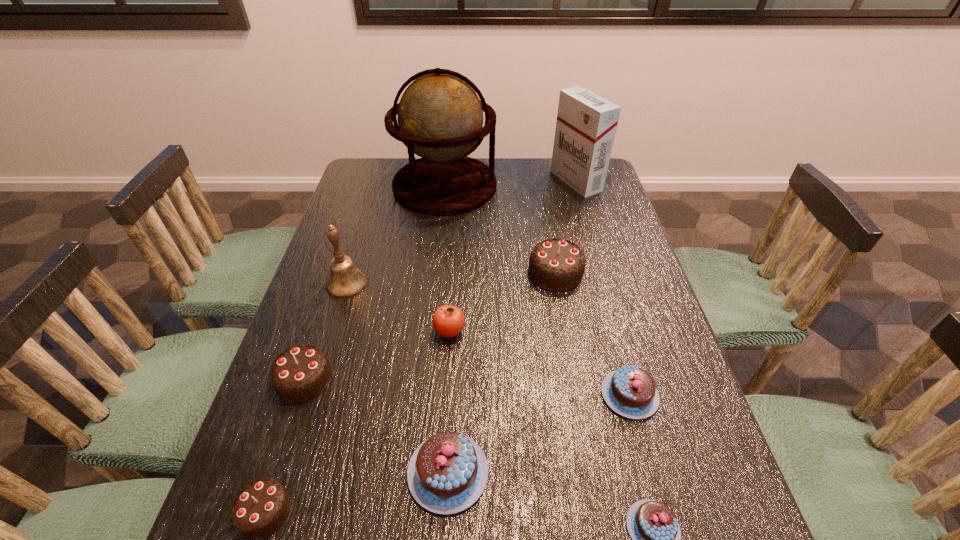
Locate an element on the screen. This screenshot has height=540, width=960. pink chocolate cake object that ranks as the second closest to the sixth nearest object is located at coordinates (630, 391).

You are a GUI agent. You are given a task and a screenshot of the screen. Output one action in this format:
    pyautogui.click(x=<x>, y=<y>)
    Task: Click on the free space in the image that satisfies the following two spatial constraints: 1. on the front side of the nearest chocolate chocolate cake; 2. on the right side of the second smallest chocolate chocolate cake
    The image size is (960, 540).
    Given the screenshot: What is the action you would take?
    pyautogui.click(x=260, y=511)

Where is `free point that satisfies the following two spatial constraints: 1. on the front-facing side of the tallest object; 2. on the right side of the biggest pink chocolate cake`? free point that satisfies the following two spatial constraints: 1. on the front-facing side of the tallest object; 2. on the right side of the biggest pink chocolate cake is located at coordinates (415, 472).

Where is `free location that satisfies the following two spatial constraints: 1. on the front-facing side of the fourth chocolate cake from right to left; 2. on the left side of the globe`? The height and width of the screenshot is (540, 960). free location that satisfies the following two spatial constraints: 1. on the front-facing side of the fourth chocolate cake from right to left; 2. on the left side of the globe is located at coordinates (415, 472).

This screenshot has height=540, width=960. I want to click on vacant space that satisfies the following two spatial constraints: 1. on the back side of the leftmost pink chocolate cake; 2. on the left side of the smallest chocolate chocolate cake, so click(x=277, y=472).